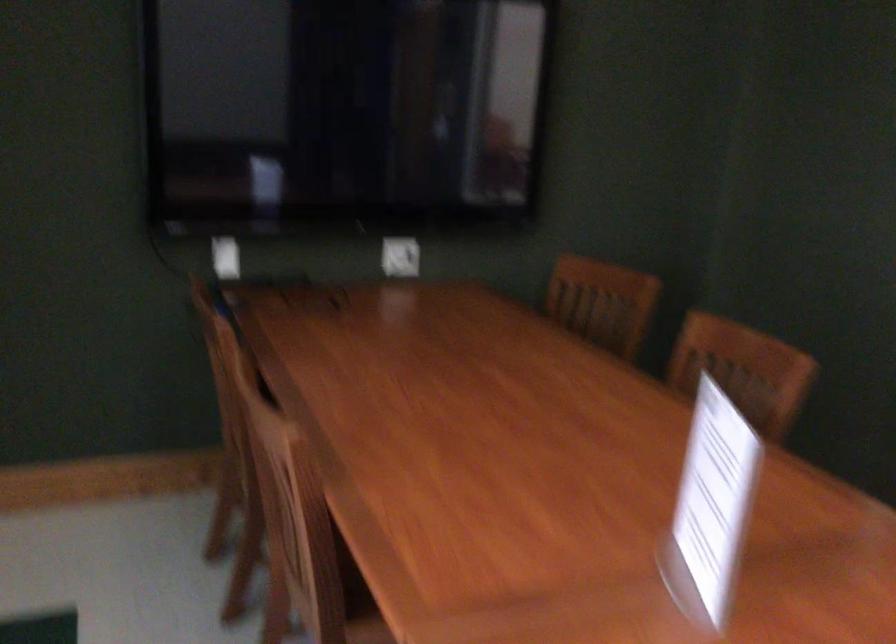
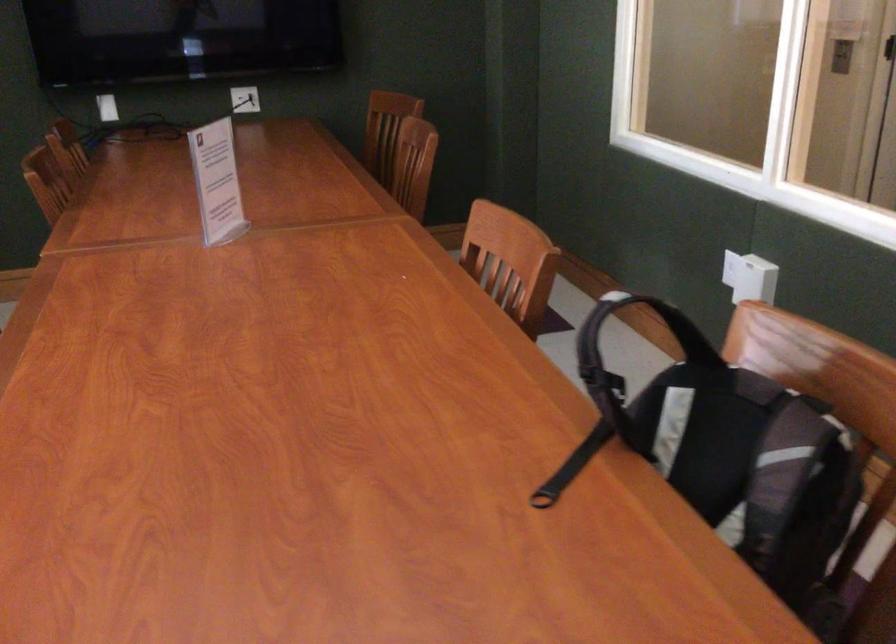
In the second image, find the point that corresponds to point 694,498 in the first image.

(217, 182)